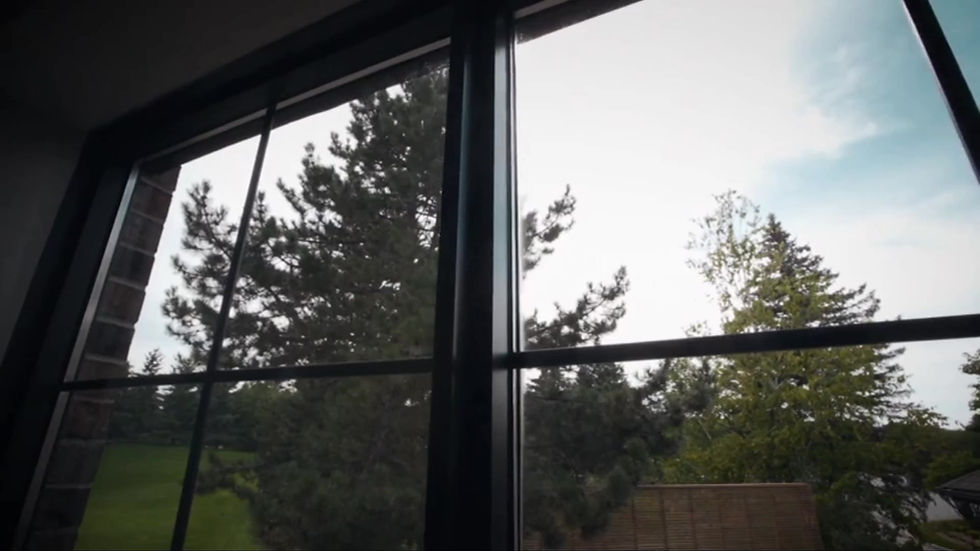
You are a GUI agent. You are given a task and a screenshot of the screen. Output one action in this format:
    pyautogui.click(x=<x>, y=<y>)
    Task: Click on the ceiling
    This screenshot has width=980, height=551.
    Given the screenshot: What is the action you would take?
    pyautogui.click(x=53, y=12)